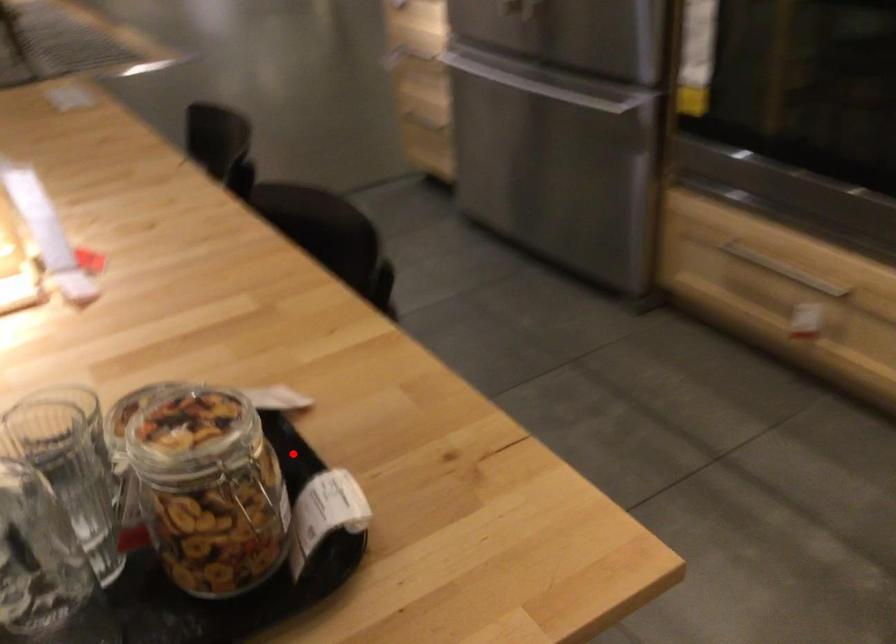
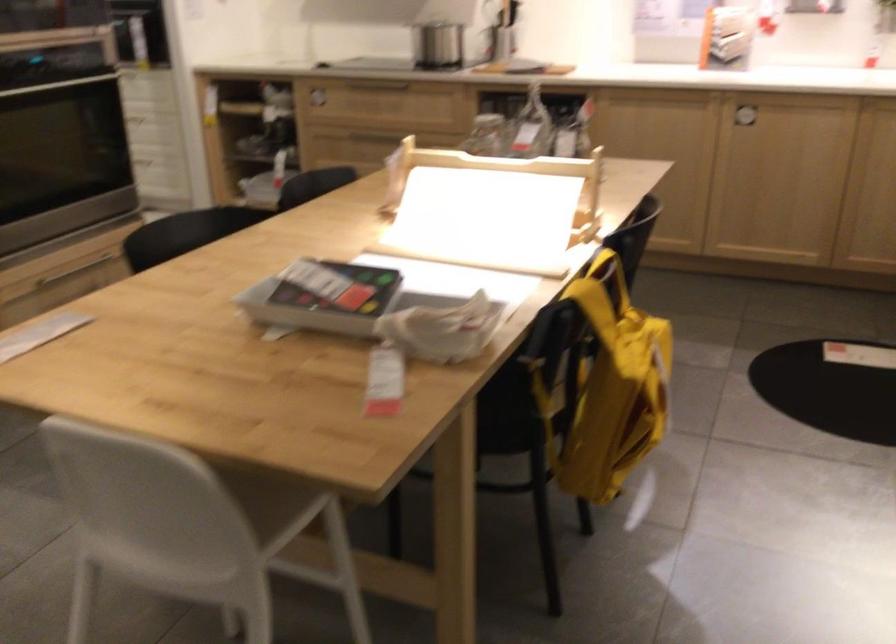
Question: I am providing you with two images of the same scene from different viewpoints. A red point is marked on the first image. At the location where the point appears in image 1, is it still visible in image 2?

Choices:
 (A) Yes
 (B) No

Answer: (B)